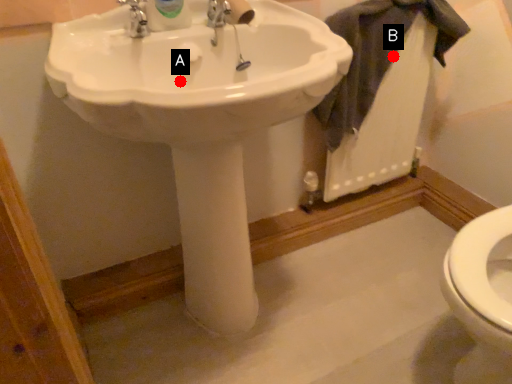
Question: Two points are circled on the image, labeled by A and B beside each circle. Among these points, which one is farthest from the camera?

Choices:
 (A) A is further
 (B) B is further

Answer: (B)